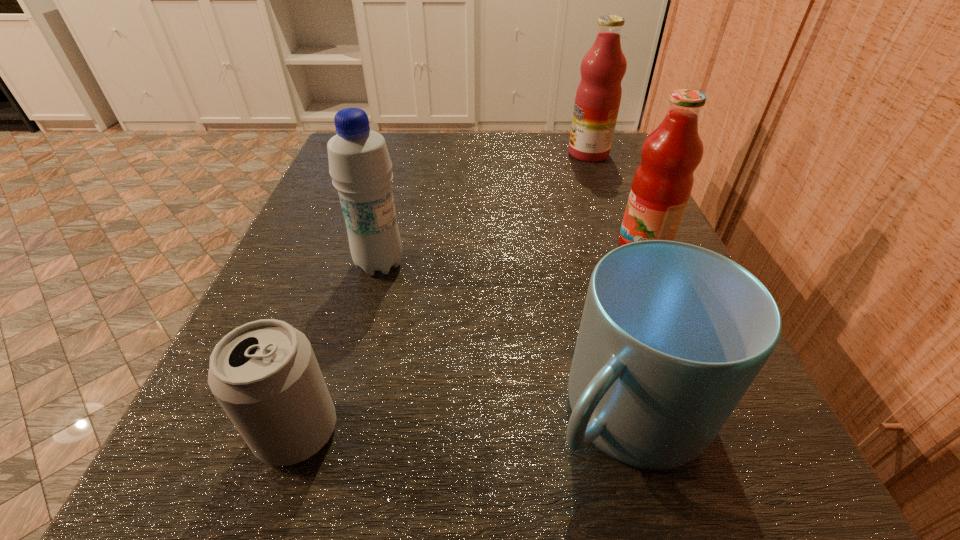
The image size is (960, 540). Identify the location of the farthest object. (598, 96).

The height and width of the screenshot is (540, 960). What are the coordinates of `the nearer fruit juice` in the screenshot? It's located at (662, 184).

This screenshot has height=540, width=960. Find the location of `water bottle`. water bottle is located at coordinates (360, 166).

The image size is (960, 540). Find the location of `mug`. mug is located at coordinates (672, 335).

Find the location of a particular element. The height and width of the screenshot is (540, 960). the shortest object is located at coordinates (264, 374).

Where is `free location located on the label of the farthest object`? free location located on the label of the farthest object is located at coordinates (453, 154).

At what (x,y) coordinates should I click in order to perform the action: click on vacant space located on the label of the farthest object. Please return your answer as a coordinate pair (x, y). The image size is (960, 540). Looking at the image, I should click on click(x=482, y=154).

Where is `vacant space situated on the label of the farthest object`? This screenshot has width=960, height=540. vacant space situated on the label of the farthest object is located at coordinates (506, 154).

This screenshot has width=960, height=540. I want to click on vacant space situated 0.220m on the front label of the nearer fruit juice, so click(477, 246).

Image resolution: width=960 pixels, height=540 pixels. Find the location of `free space located 0.140m on the front label of the nearer fruit juice`. free space located 0.140m on the front label of the nearer fruit juice is located at coordinates (528, 246).